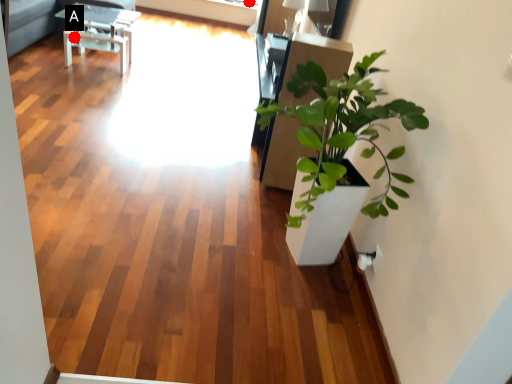
Question: Two points are circled on the image, labeled by A and B beside each circle. Which point is farther to the camera?

Choices:
 (A) A is further
 (B) B is further

Answer: (B)